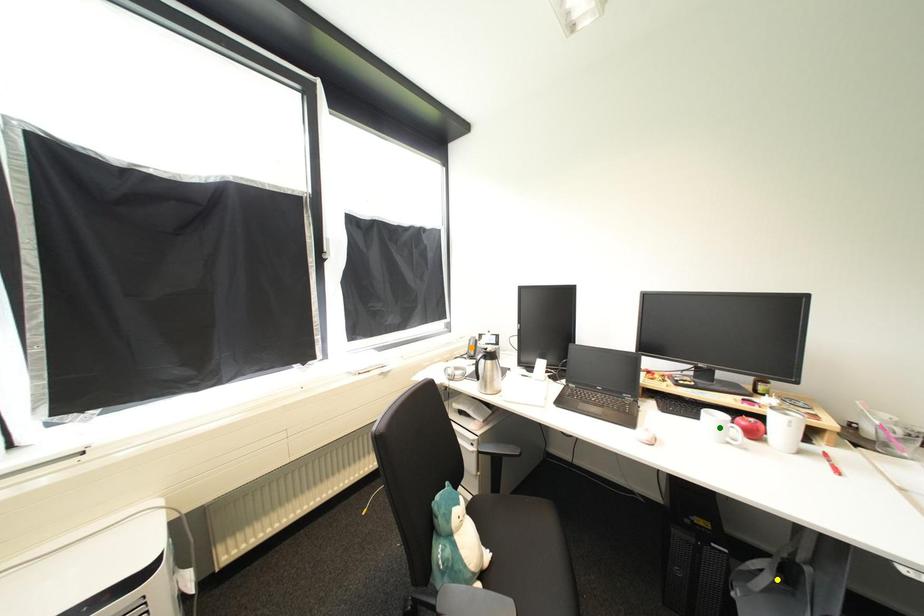
Order these from nearest to farthest:
A) orange point
B) yellow point
C) green point

orange point → green point → yellow point